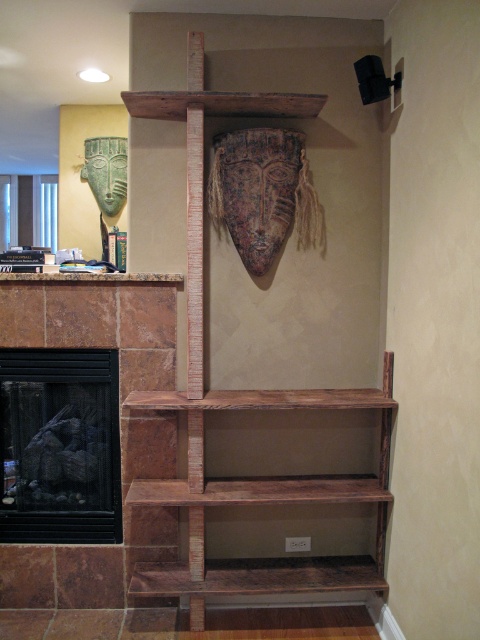
Question: Does rustic wood bookshelf at center have a greater width compared to black glass fireplace at left?

Choices:
 (A) no
 (B) yes

Answer: (B)

Question: Which point appears closest to the camera in this image?

Choices:
 (A) (308, 355)
 (B) (80, 534)

Answer: (A)

Question: Is black glass fireplace at left thinner than brown wood mantle at upper center?

Choices:
 (A) no
 (B) yes

Answer: (B)

Question: Which of the following is the closest to the observer?

Choices:
 (A) brown wood mantle at upper center
 (B) rustic wood bookshelf at center

Answer: (B)

Question: In this image, where is rustic wood bookshelf at center located relative to black glass fireplace at left?

Choices:
 (A) right
 (B) left

Answer: (A)

Question: Which object is closer to the camera taking this photo?

Choices:
 (A) brown wood mantle at upper center
 (B) rustic wood bookshelf at center

Answer: (B)